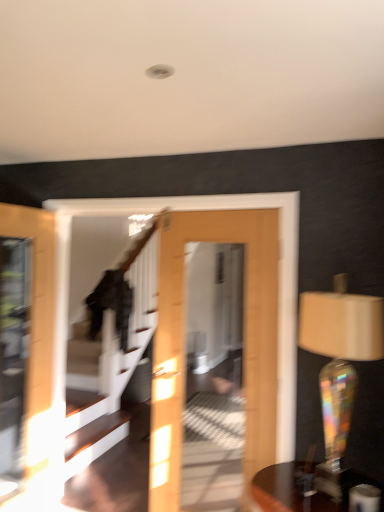
Question: In terms of width, does iridescent glass table lamp at right look wider or thinner when compared to wooden round table at lower right?

Choices:
 (A) wide
 (B) thin

Answer: (B)

Question: In the image, is iridescent glass table lamp at right positioned in front of or behind wooden round table at lower right?

Choices:
 (A) behind
 (B) front

Answer: (A)

Question: From the image's perspective, is iridescent glass table lamp at right located above or below wooden round table at lower right?

Choices:
 (A) above
 (B) below

Answer: (A)

Question: Is wooden round table at lower right in front of or behind iridescent glass table lamp at right in the image?

Choices:
 (A) behind
 (B) front

Answer: (B)

Question: Is point (289, 501) positioned closer to the camera than point (380, 463)?

Choices:
 (A) farther
 (B) closer

Answer: (B)

Question: Considering the positions of wooden round table at lower right and iridescent glass table lamp at right in the image, is wooden round table at lower right wider or thinner than iridescent glass table lamp at right?

Choices:
 (A) wide
 (B) thin

Answer: (A)

Question: From the image's perspective, relative to iridescent glass table lamp at right, is wooden round table at lower right above or below?

Choices:
 (A) below
 (B) above

Answer: (A)